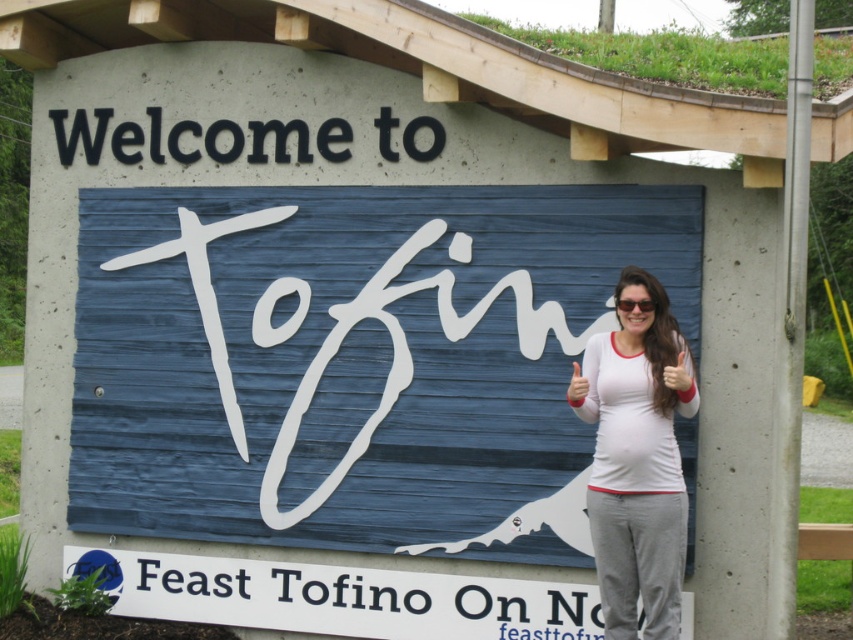
Question: Can you confirm if black plastic sign at upper center is positioned to the right of matte white sunglasses at center?

Choices:
 (A) no
 (B) yes

Answer: (A)

Question: Among these objects, which one is farthest from the camera?

Choices:
 (A) black plastic sign at upper center
 (B) white plastic sign at lower center
 (C) white cotton shirt at center
 (D) matte white sunglasses at center

Answer: (A)

Question: Considering the relative positions of white plastic sign at lower center and matte white sunglasses at center in the image provided, where is white plastic sign at lower center located with respect to matte white sunglasses at center?

Choices:
 (A) right
 (B) left

Answer: (B)

Question: Which point is closer to the camera?

Choices:
 (A) black plastic sign at upper center
 (B) white cotton shirt at center
 (C) matte white sunglasses at center
 (D) white plastic sign at lower center

Answer: (B)

Question: Does white cotton shirt at center have a larger size compared to black plastic sign at upper center?

Choices:
 (A) yes
 (B) no

Answer: (A)

Question: Which of these objects is positioned closest to the matte white sunglasses at center?

Choices:
 (A) white plastic sign at lower center
 (B) white cotton shirt at center
 (C) black plastic sign at upper center

Answer: (B)